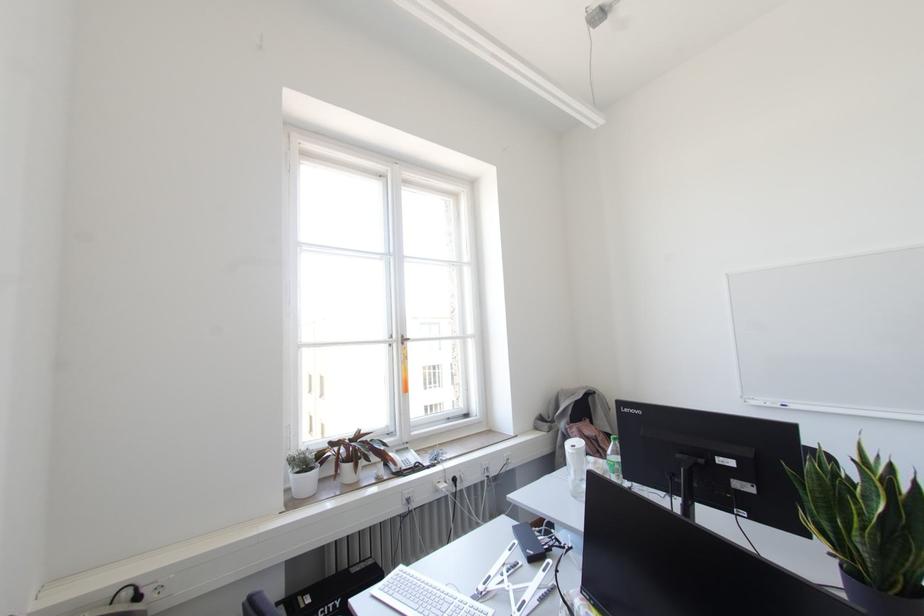
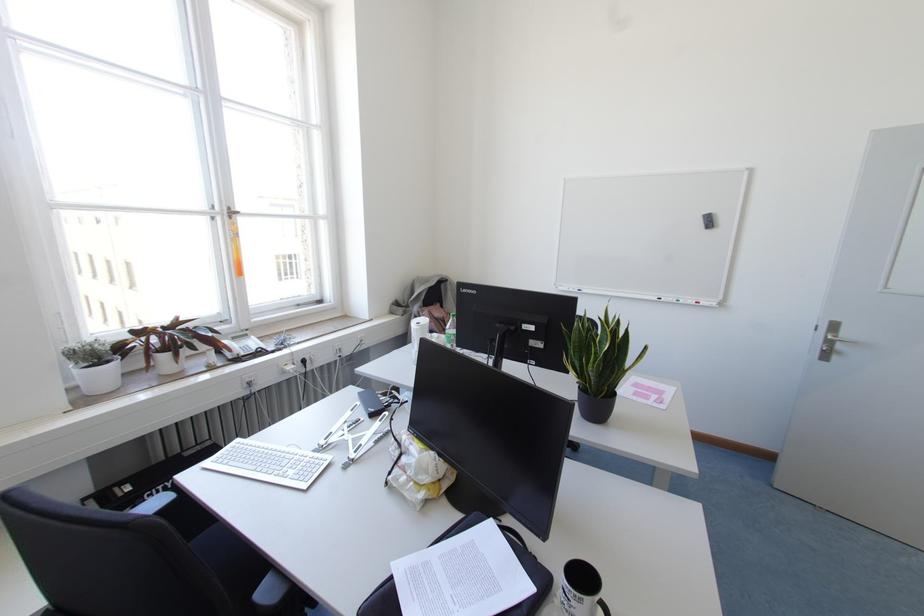
The point at (290, 476) is marked in the first image. Where is the corresponding point in the second image?

(75, 371)